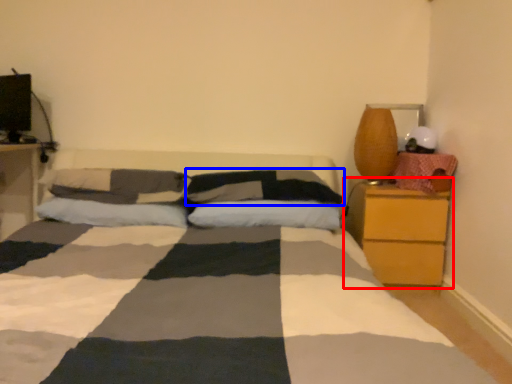
Question: Which point is further to the camera, nightstand (highlighted by a red box) or pillow (highlighted by a blue box)?

Choices:
 (A) nightstand
 (B) pillow

Answer: (A)